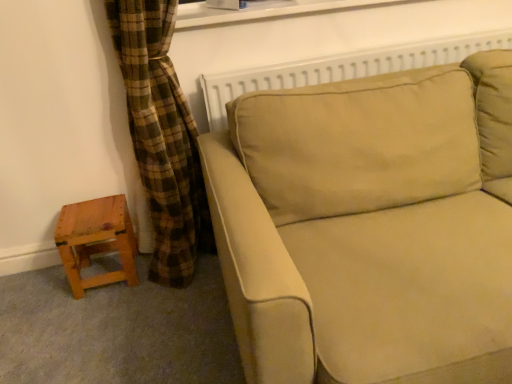
Question: From a real-world perspective, is beige fabric couch at center on wooden stool at lower left?

Choices:
 (A) yes
 (B) no

Answer: (A)

Question: Would you say beige fabric couch at center contains wooden stool at lower left?

Choices:
 (A) yes
 (B) no

Answer: (B)

Question: Is beige fabric couch at center not near wooden stool at lower left?

Choices:
 (A) yes
 (B) no

Answer: (B)

Question: Considering the relative sizes of beige fabric couch at center and wooden stool at lower left in the image provided, is beige fabric couch at center wider than wooden stool at lower left?

Choices:
 (A) no
 (B) yes

Answer: (B)

Question: From a real-world perspective, is beige fabric couch at center under wooden stool at lower left?

Choices:
 (A) no
 (B) yes

Answer: (A)

Question: Does beige fabric couch at center have a smaller size compared to wooden stool at lower left?

Choices:
 (A) no
 (B) yes

Answer: (A)

Question: Is wooden stool at lower left touching beige fabric couch at center?

Choices:
 (A) yes
 (B) no

Answer: (B)

Question: Can you confirm if wooden stool at lower left is shorter than beige fabric couch at center?

Choices:
 (A) no
 (B) yes

Answer: (B)

Question: Is there a large distance between wooden stool at lower left and beige fabric couch at center?

Choices:
 (A) no
 (B) yes

Answer: (A)

Question: Considering the relative sizes of wooden stool at lower left and beige fabric couch at center in the image provided, is wooden stool at lower left wider than beige fabric couch at center?

Choices:
 (A) no
 (B) yes

Answer: (A)

Question: From the image's perspective, would you say wooden stool at lower left is positioned over beige fabric couch at center?

Choices:
 (A) yes
 (B) no

Answer: (B)

Question: Does wooden stool at lower left contain beige fabric couch at center?

Choices:
 (A) yes
 (B) no

Answer: (B)

Question: From the image's perspective, is white plastic window frame at upper center beneath beige fabric couch at center?

Choices:
 (A) no
 (B) yes

Answer: (A)